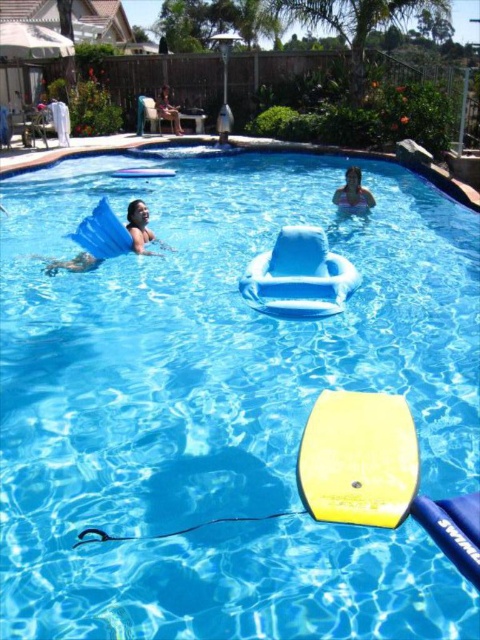
Question: Among these points, which one is farthest from the camera?

Choices:
 (A) (x=104, y=202)
 (B) (x=162, y=104)
 (C) (x=300, y=474)

Answer: (B)

Question: Which object is positioned farthest from the smooth skin at upper center?

Choices:
 (A) yellow foam paddle at center
 (B) matte blue floatie at upper left

Answer: (B)

Question: Does yellow foam paddle at center have a smaller size compared to smooth skin at upper center?

Choices:
 (A) no
 (B) yes

Answer: (A)

Question: From the image, what is the correct spatial relationship of blue rubber mermaid tail at upper left in relation to matte blue floatie at upper left?

Choices:
 (A) right
 (B) left

Answer: (A)

Question: Which point is closer to the camera?

Choices:
 (A) yellow foam paddle at center
 (B) matte blue floatie at upper left
 (C) blue rubber mermaid tail at upper left
 (D) smooth skin at upper center

Answer: (A)

Question: Is yellow foam paddle at center further to camera compared to smooth skin at upper center?

Choices:
 (A) no
 (B) yes

Answer: (A)